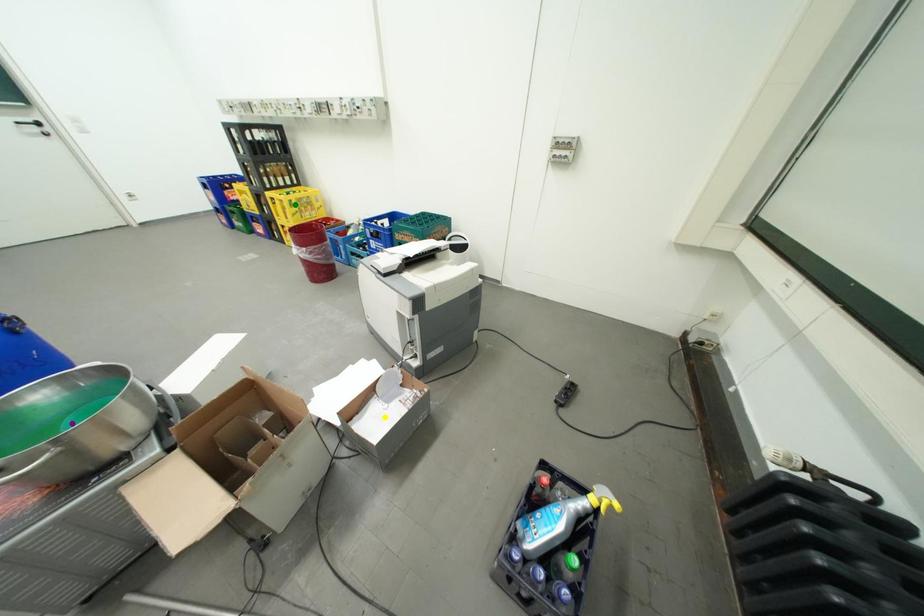
Order these from nearest to farthest:
1. yellow point
2. green point
3. purple point

purple point < yellow point < green point